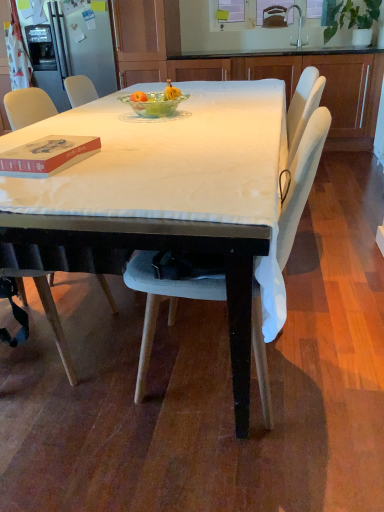
Locate an element on the screen. free space in front of light gray fabric chair at center is located at coordinates (225, 461).